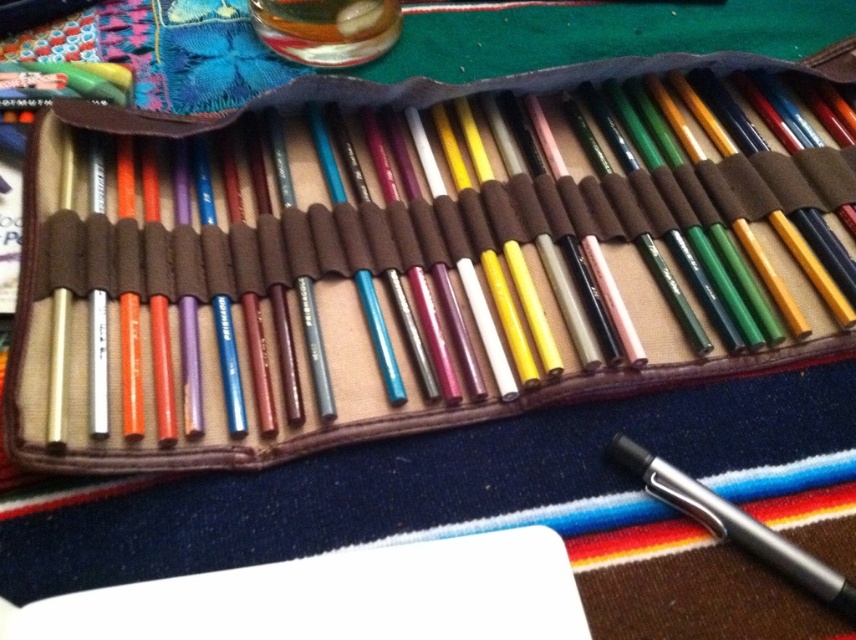
Question: Which object appears closest to the camera in this image?

Choices:
 (A) metallic silver pen at lower right
 (B) white paper at lower center

Answer: (B)

Question: Which point is farther from the camera taking this photo?

Choices:
 (A) (670, 490)
 (B) (471, 600)

Answer: (A)

Question: Does white paper at lower center appear on the left side of metallic silver pen at lower right?

Choices:
 (A) yes
 (B) no

Answer: (A)

Question: Which object appears closest to the camera in this image?

Choices:
 (A) white paper at lower center
 (B) metallic silver pen at lower right

Answer: (A)

Question: Does white paper at lower center appear under metallic silver pen at lower right?

Choices:
 (A) no
 (B) yes

Answer: (B)

Question: Is white paper at lower center to the right of metallic silver pen at lower right from the viewer's perspective?

Choices:
 (A) no
 (B) yes

Answer: (A)